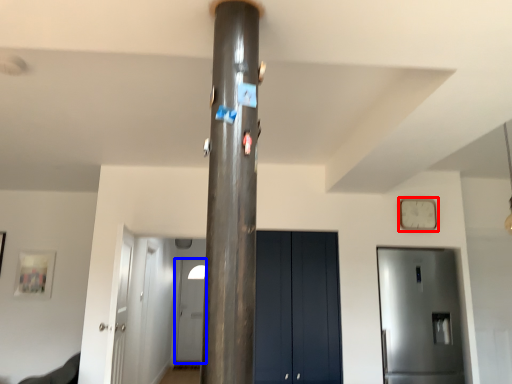
Question: Among these objects, which one is nearest to the camera, clock (highlighted by a red box) or door (highlighted by a blue box)?

Choices:
 (A) clock
 (B) door

Answer: (A)